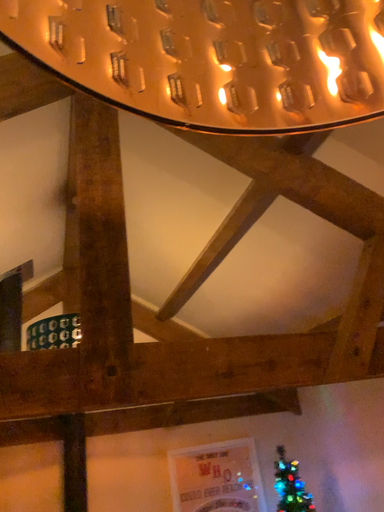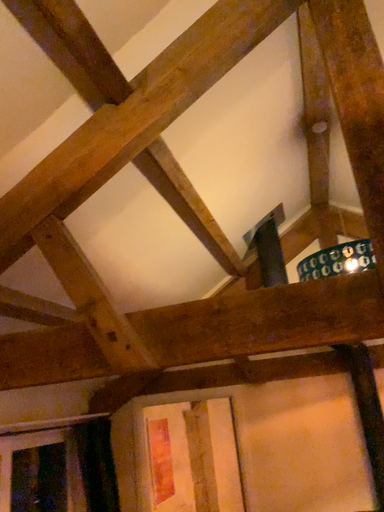
Question: Which way did the camera rotate in the video?

Choices:
 (A) rotated upward
 (B) rotated downward

Answer: (B)